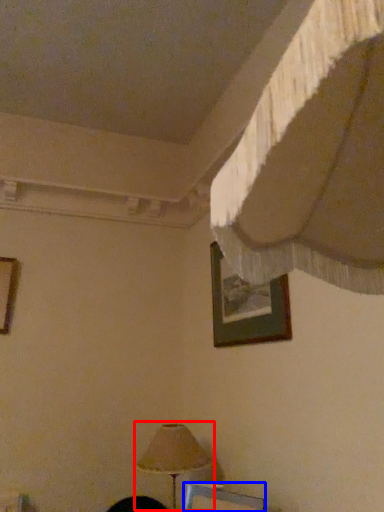
Question: Which point is further to the camera, lamp (highlighted by a red box) or picture frame (highlighted by a blue box)?

Choices:
 (A) lamp
 (B) picture frame

Answer: (A)